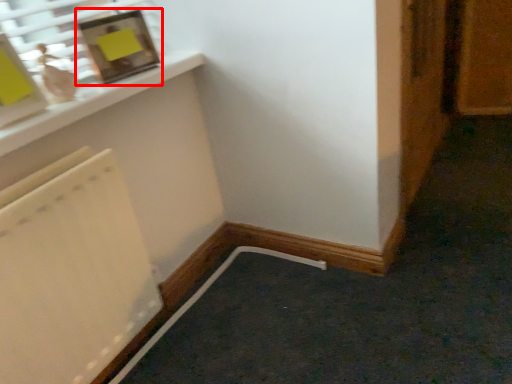
Question: From the image's perspective, considering the relative positions of picture frame (annotated by the red box) and door in the image provided, where is picture frame (annotated by the red box) located with respect to the staircase?

Choices:
 (A) above
 (B) below

Answer: (B)